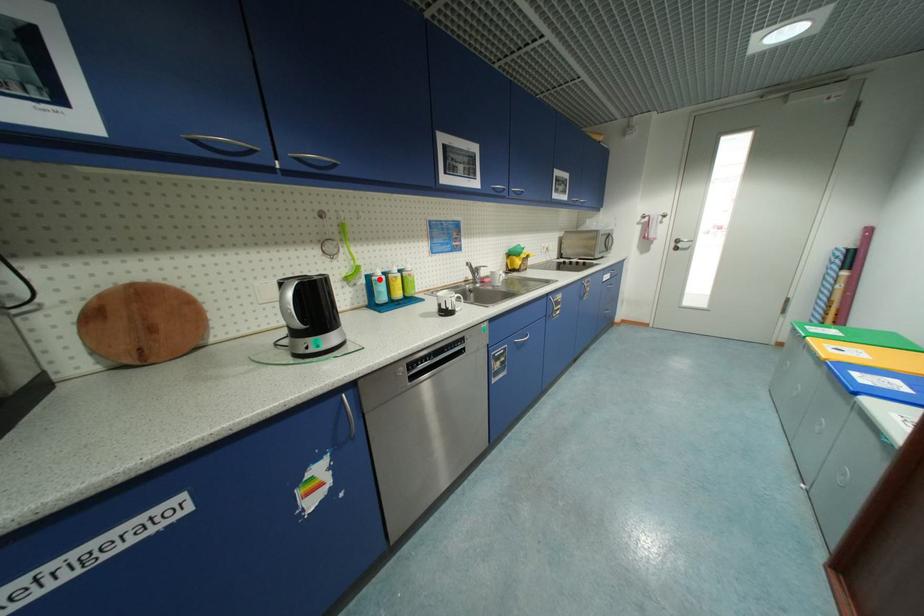
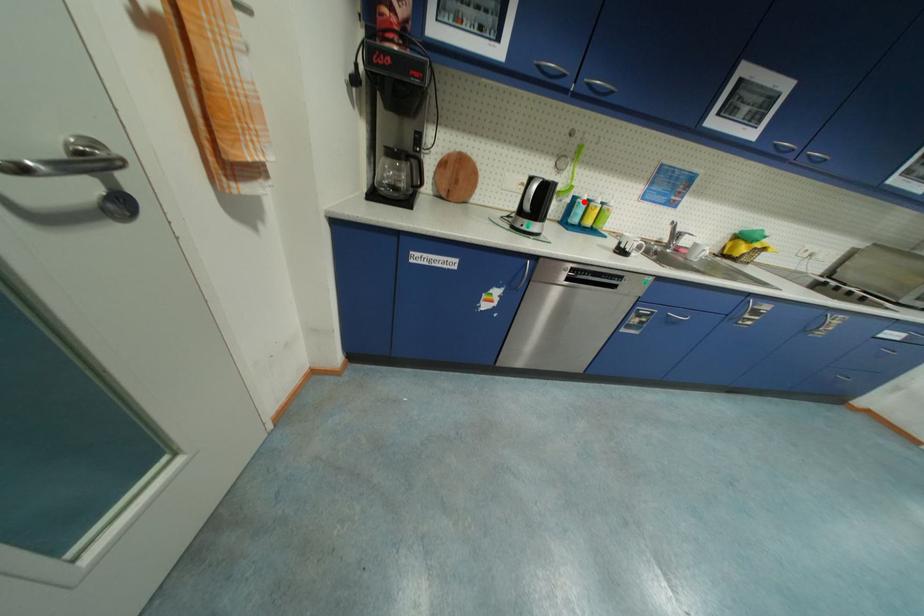
I am providing you with two images of the same scene from different viewpoints. A red point is marked on the first image and another point is marked on the second image. Do the highlighted points in image1 and image2 indicate the same real-world spot?

Yes